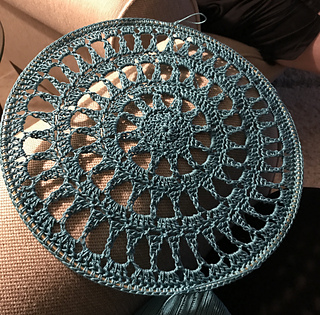
In order to click on green dreamcatcher in this screenshot , I will do `click(112, 278)`.